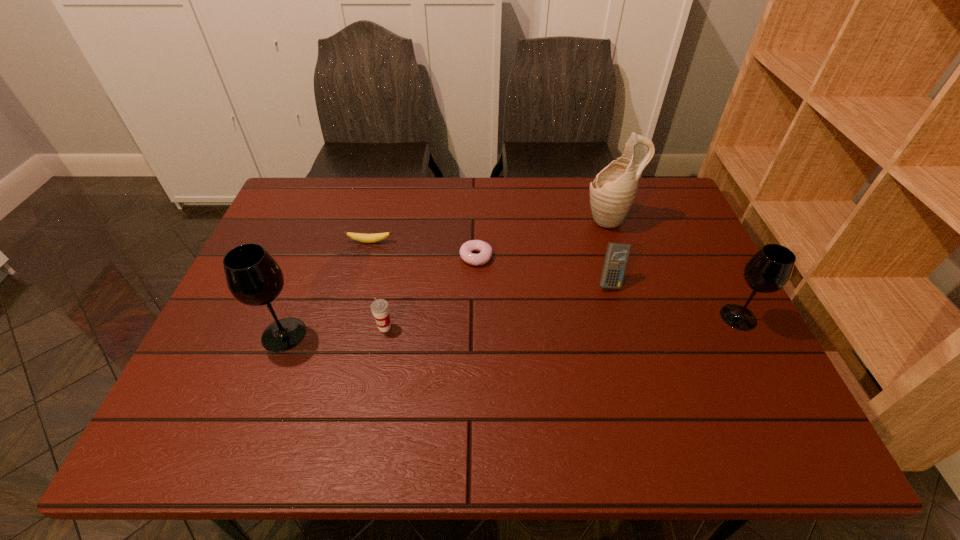
What are the coordinates of `the taller wineglass` in the screenshot? It's located at (254, 278).

Where is `the left wineglass`? This screenshot has width=960, height=540. the left wineglass is located at coordinates (254, 278).

Where is `the right wineglass`? This screenshot has height=540, width=960. the right wineglass is located at coordinates (769, 270).

This screenshot has width=960, height=540. Find the location of `the shorter wineglass`. the shorter wineglass is located at coordinates (769, 270).

Find the location of `banana`. banana is located at coordinates (366, 238).

Locate an element on the screen. The width and height of the screenshot is (960, 540). the fourth farthest object is located at coordinates tap(617, 254).

This screenshot has height=540, width=960. In order to click on pitcher in this screenshot , I will do `click(612, 193)`.

Identify the location of cup. (380, 308).

Locate an element on the screen. the fourth object from left to right is located at coordinates (485, 249).

The image size is (960, 540). In order to click on the third farthest object in this screenshot , I will do `click(485, 249)`.